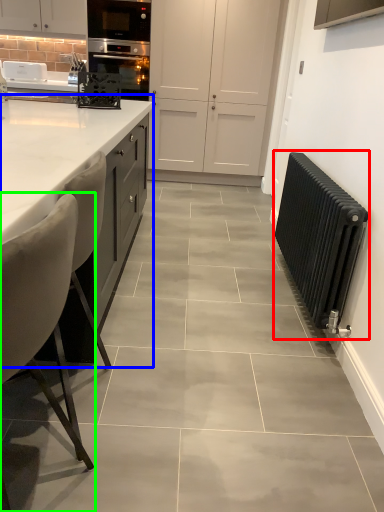
Question: Considering the real-world distances, which object is farthest from radiator (highlighted by a red box)? countertop (highlighted by a blue box) or chair (highlighted by a green box)?

Choices:
 (A) countertop
 (B) chair

Answer: (B)